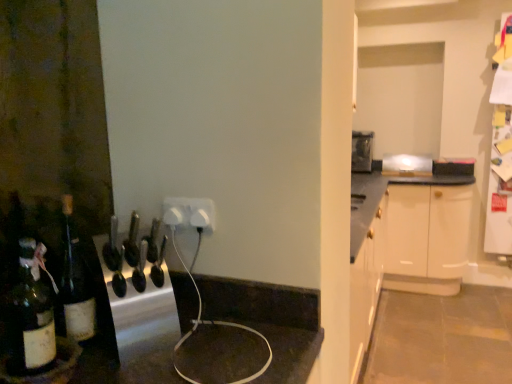
Question: Can we say white plastic outlet at center lies outside translucent glass bottle at left?

Choices:
 (A) no
 (B) yes

Answer: (B)

Question: Is translucent glass bottle at left surrounded by white plastic outlet at center?

Choices:
 (A) no
 (B) yes

Answer: (A)

Question: Is white plastic outlet at center not close to translucent glass bottle at left?

Choices:
 (A) yes
 (B) no

Answer: (B)

Question: Is white plastic outlet at center at the right side of translucent glass bottle at left?

Choices:
 (A) no
 (B) yes

Answer: (B)

Question: Is white plastic outlet at center further to the viewer compared to translucent glass bottle at left?

Choices:
 (A) yes
 (B) no

Answer: (A)

Question: From a real-world perspective, is white plastic outlet at center physically above translucent glass bottle at left?

Choices:
 (A) yes
 (B) no

Answer: (A)

Question: Is translucent glass bottle at left taller than white plastic outlet at center?

Choices:
 (A) yes
 (B) no

Answer: (A)

Question: Does translucent glass bottle at left have a lesser height compared to white plastic outlet at center?

Choices:
 (A) no
 (B) yes

Answer: (A)

Question: Is translucent glass bottle at left in front of white plastic outlet at center?

Choices:
 (A) no
 (B) yes

Answer: (B)

Question: Is translucent glass bottle at left to the left of white plastic outlet at center from the viewer's perspective?

Choices:
 (A) yes
 (B) no

Answer: (A)

Question: From the image's perspective, does translucent glass bottle at left appear higher than white plastic outlet at center?

Choices:
 (A) yes
 (B) no

Answer: (B)

Question: Is translucent glass bottle at left at the right side of white plastic outlet at center?

Choices:
 (A) no
 (B) yes

Answer: (A)

Question: From a real-world perspective, is dark brown glass bottle at lower left under white plastic outlet at center?

Choices:
 (A) no
 (B) yes

Answer: (B)